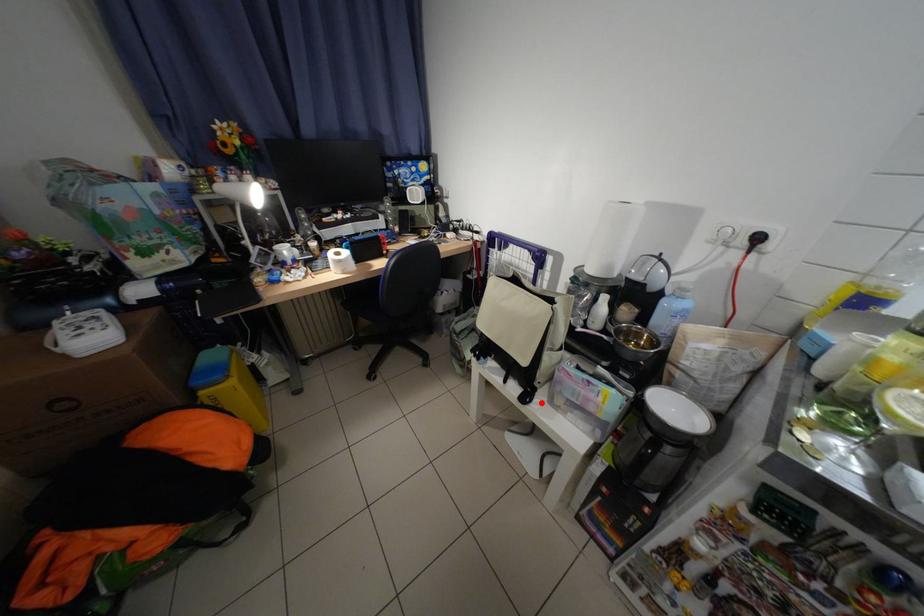
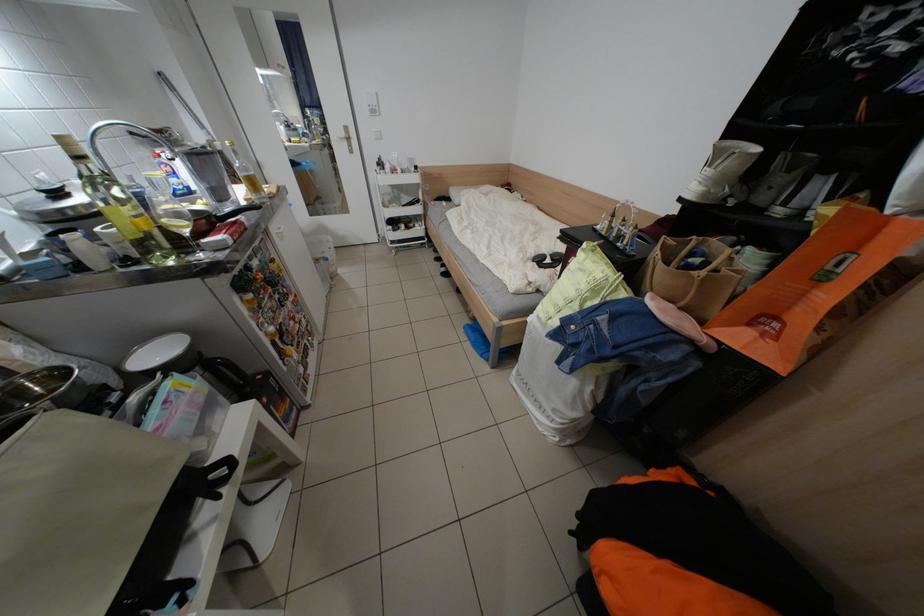
In the second image, find the point that corresponds to the highlighted location in the first image.

(238, 463)